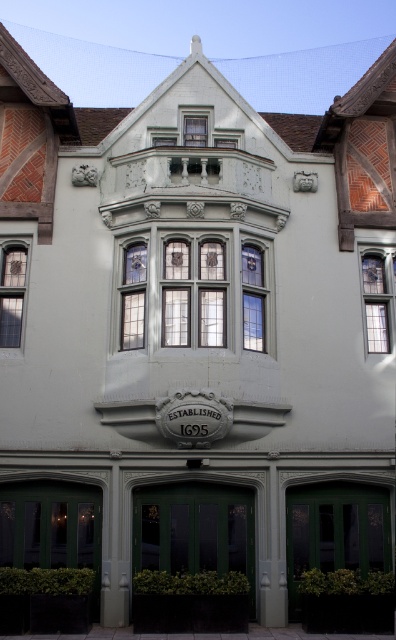
You are standing in front of the building and want to know the relative positions of the clear glass windows at center and the clear glass window at left. Which one is higher up?

The clear glass windows at center is positioned over the clear glass window at left, so it is higher up.